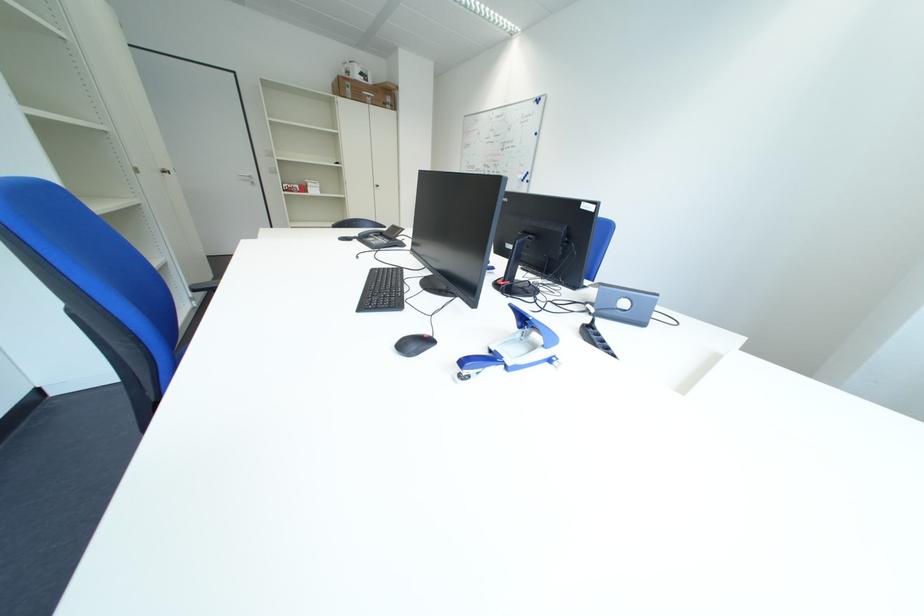
The height and width of the screenshot is (616, 924). I want to click on black chair armrest, so click(213, 274).